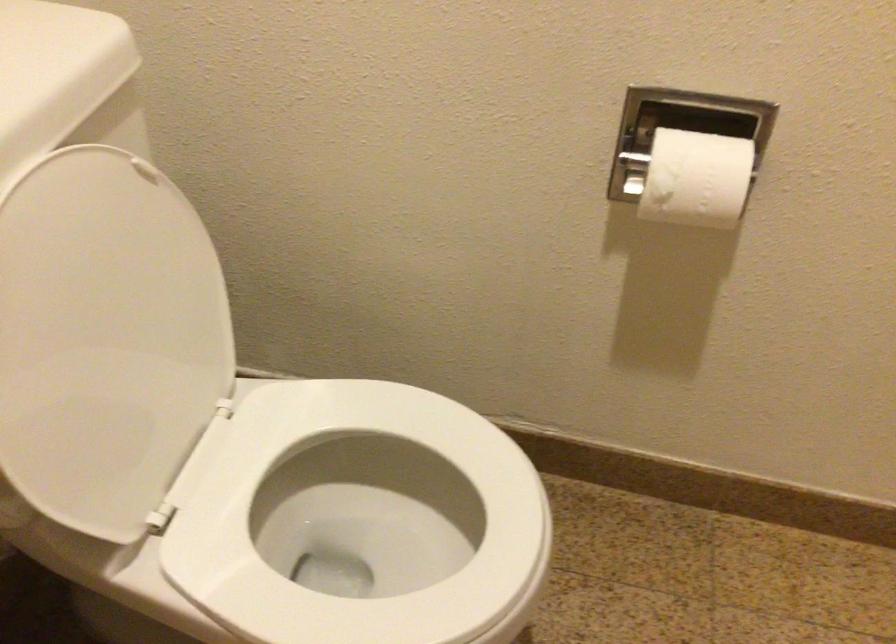
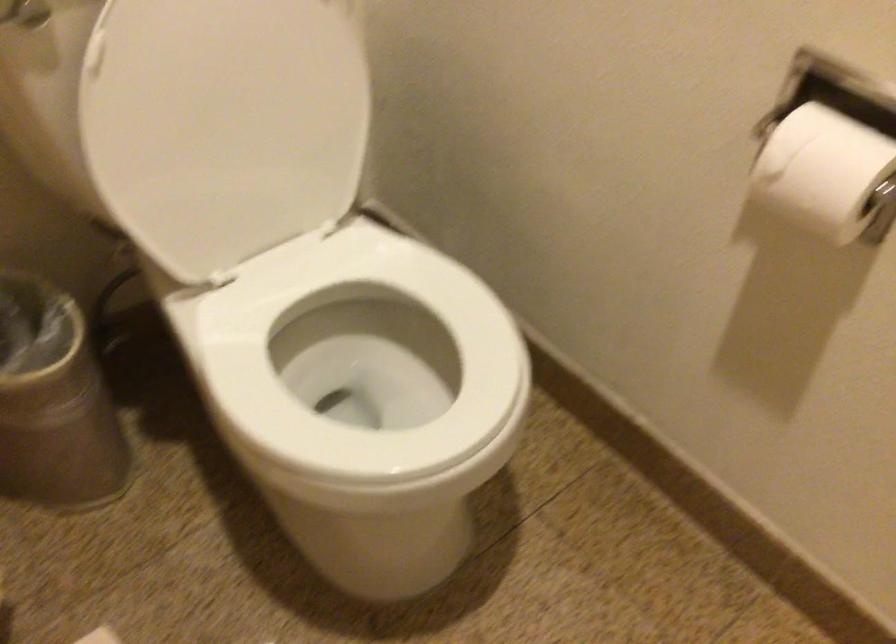
In the second image, find the point that corresponds to point (119, 337) in the first image.

(239, 114)